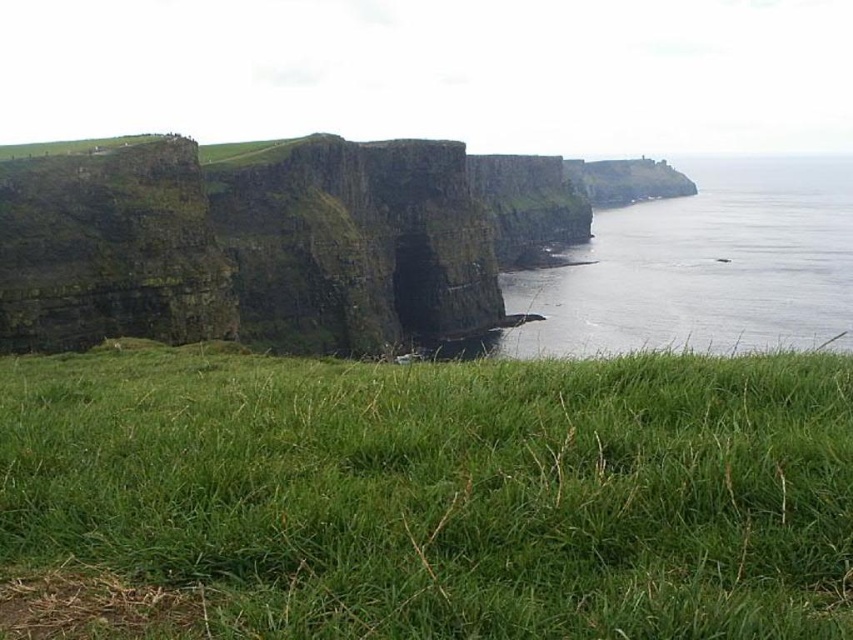
Question: Which object appears farthest from the camera in this image?

Choices:
 (A) green grassy at lower center
 (B) transparent water at right

Answer: (B)

Question: Which object is closer to the camera taking this photo?

Choices:
 (A) transparent water at right
 (B) green grassy at lower center

Answer: (B)

Question: Is green grassy at lower center to the left of transparent water at right from the viewer's perspective?

Choices:
 (A) yes
 (B) no

Answer: (A)

Question: Can you confirm if green grassy at lower center is thinner than transparent water at right?

Choices:
 (A) no
 (B) yes

Answer: (B)

Question: Can you confirm if green grassy at lower center is smaller than transparent water at right?

Choices:
 (A) yes
 (B) no

Answer: (A)